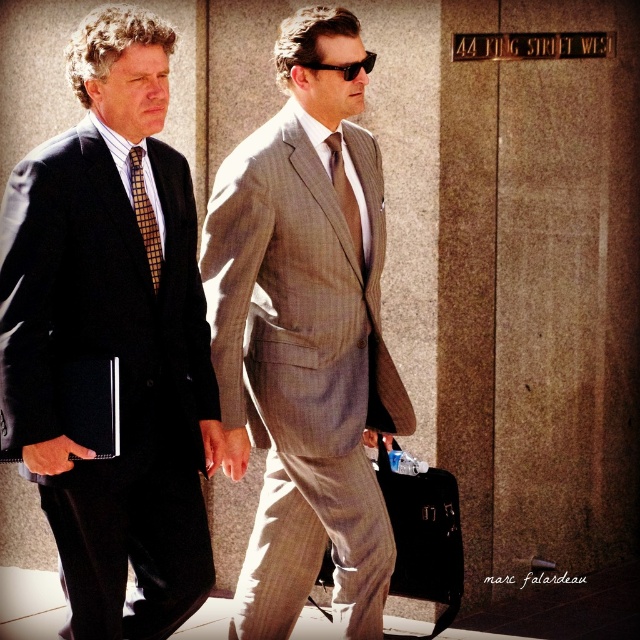
Which of these two, matte black suit at left or black plastic sunglasses at center, stands taller?

With more height is matte black suit at left.

Does matte black suit at left appear over black plastic sunglasses at center?

Incorrect, matte black suit at left is not positioned above black plastic sunglasses at center.

Locate an element on the screen. matte black suit at left is located at coordinates (113, 339).

Which is in front, point (115, 467) or point (141, 230)?

Positioned in front is point (115, 467).

Is matte black suit at left to the left of checkered fabric tie at left from the viewer's perspective?

Yes, matte black suit at left is to the left of checkered fabric tie at left.

Find the location of `matte black suit at left`. matte black suit at left is located at coordinates (113, 339).

You are a GUI agent. You are given a task and a screenshot of the screen. Output one action in this format:
    pyautogui.click(x=<x>, y=<y>)
    Task: Click on the checkered fabric tie at left
    
    Given the screenshot: What is the action you would take?
    pyautogui.click(x=145, y=216)

Image resolution: width=640 pixels, height=640 pixels. I want to click on checkered fabric tie at left, so point(145,216).